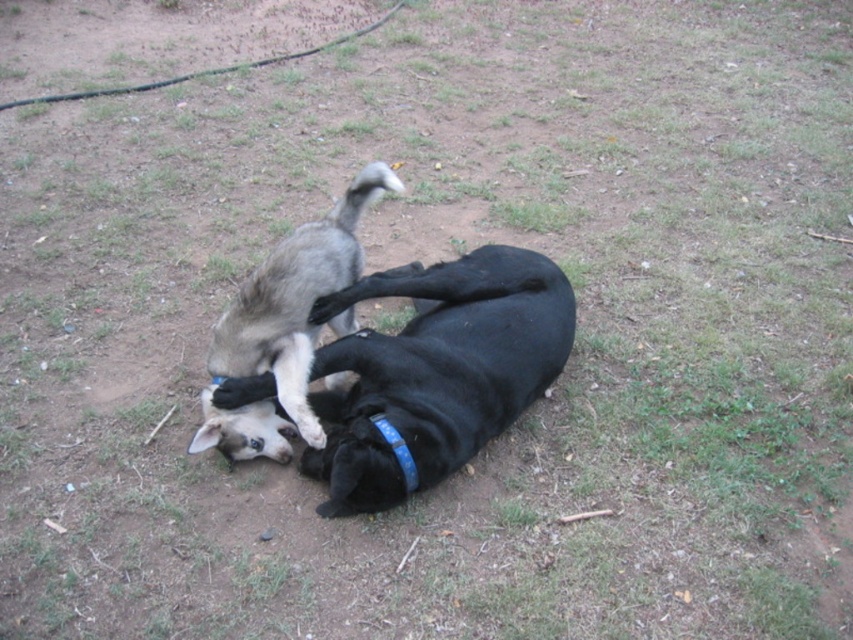
Question: Estimate the real-world distances between objects in this image. Which object is farther from the blue plastic neckband at center?

Choices:
 (A) gray fur puppy at center
 (B) black matte dog at center

Answer: (A)

Question: Can you confirm if black matte dog at center is bigger than blue plastic neckband at center?

Choices:
 (A) yes
 (B) no

Answer: (A)

Question: Does gray fur puppy at center appear on the left side of blue plastic neckband at center?

Choices:
 (A) yes
 (B) no

Answer: (A)

Question: Can you confirm if black matte dog at center is bigger than blue plastic neckband at center?

Choices:
 (A) yes
 (B) no

Answer: (A)

Question: Which point is closer to the camera taking this photo?

Choices:
 (A) (437, 376)
 (B) (280, 422)

Answer: (A)

Question: Which point is closer to the camera?

Choices:
 (A) (383, 420)
 (B) (329, 250)

Answer: (A)